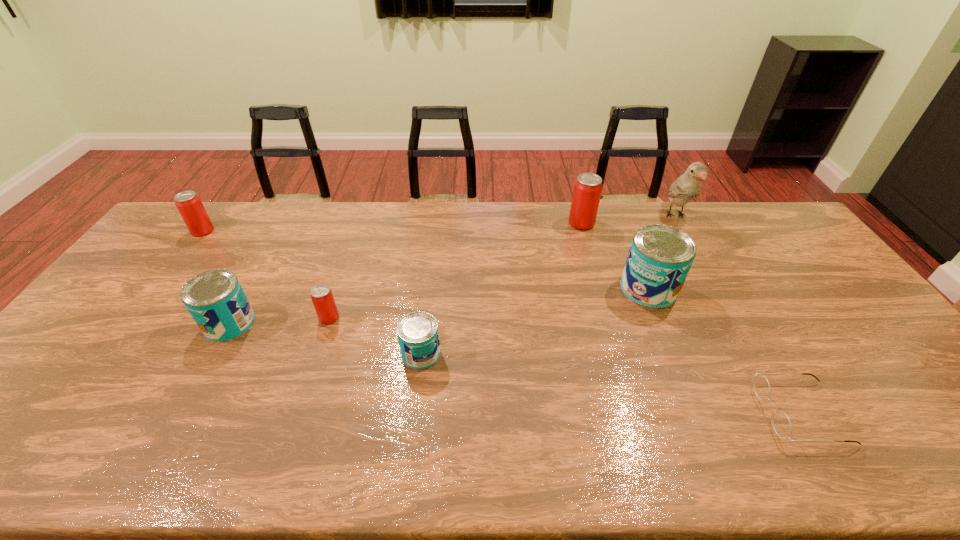
This screenshot has height=540, width=960. What are the coordinates of `red can that is the third closest one to the second blue can from right to left` in the screenshot? It's located at (188, 203).

Find the location of a particular element. free space that satisfies the following two spatial constraints: 1. on the back side of the second object from left to right; 2. on the left side of the smallest red can is located at coordinates (232, 318).

This screenshot has height=540, width=960. In order to click on free location that satisfies the following two spatial constraints: 1. on the front side of the third can from left to right; 2. on the right side of the second blue can from left to right in this screenshot , I will do `click(317, 354)`.